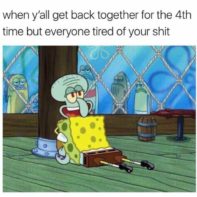
The width and height of the screenshot is (197, 197). Identify the location of table. (178, 129).